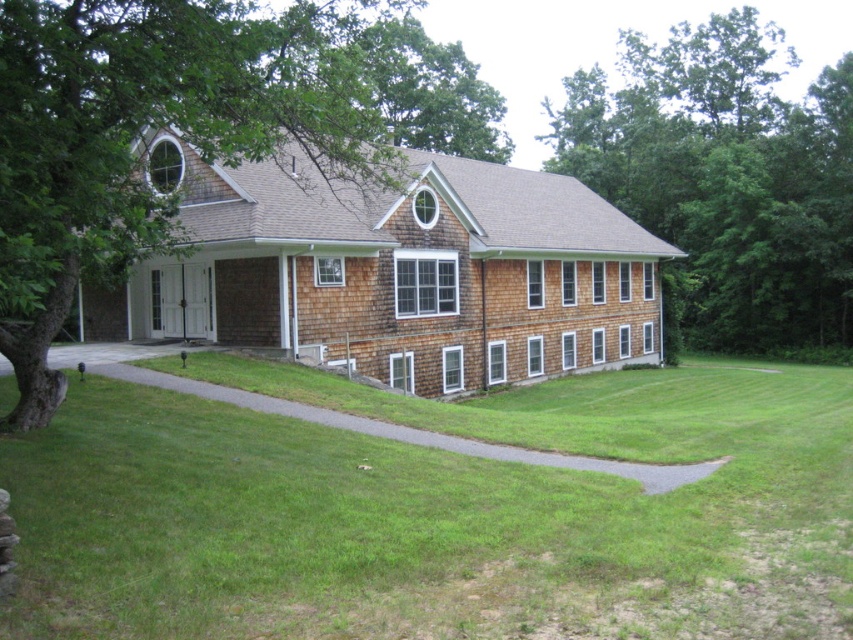
You are standing in front of the house and want to plant a new flower bed. The green grass at lower center and the green leafy tree at upper right are in your view. Which object should you avoid digging near to prevent damaging the tree roots?

You should avoid digging near the green leafy tree at upper right to prevent damaging its roots, as it is located above the green grass at lower center and its roots may extend downward towards the grass area.

You are standing in front of the house and notice a point marked at coordinates (x=146, y=132). What object does this point correspond to?

The point at coordinates (x=146, y=132) corresponds to the green leafy tree at left.